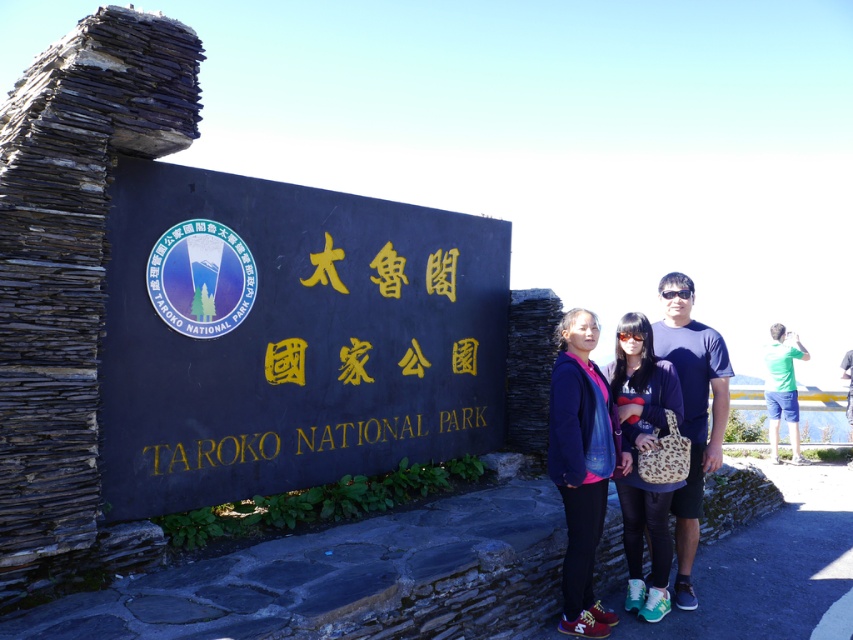
Question: Among these objects, which one is farthest from the camera?

Choices:
 (A) matte black shirt at center
 (B) goldmaterial/texturetaroko national park at center
 (C) black plastic goggles at center
 (D) black stone sign at center

Answer: (C)

Question: Is black stone sign at center above black plastic goggles at center?

Choices:
 (A) yes
 (B) no

Answer: (B)

Question: Does leopard print bag at center have a lesser width compared to black plastic goggles at center?

Choices:
 (A) no
 (B) yes

Answer: (A)

Question: Based on their relative distances, which object is farther from the leopard print bag at center?

Choices:
 (A) black plastic goggles at center
 (B) transparent plastic goggles at center
 (C) matte blue jacket at center

Answer: (A)

Question: Which point is farther from the camera taking this photo?

Choices:
 (A) (260, 435)
 (B) (660, 506)
 (C) (688, 289)
 (D) (651, 419)

Answer: (C)

Question: Can you confirm if matte blue jacket at center is smaller than transparent plastic goggles at center?

Choices:
 (A) no
 (B) yes

Answer: (A)